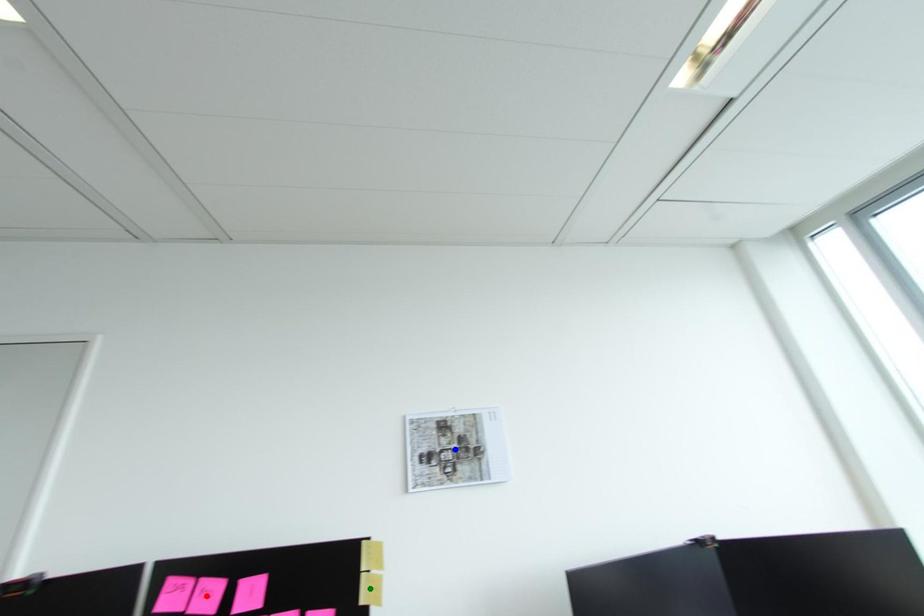
Order these from nearest to farthest:
blue point | green point | red point

1. red point
2. green point
3. blue point